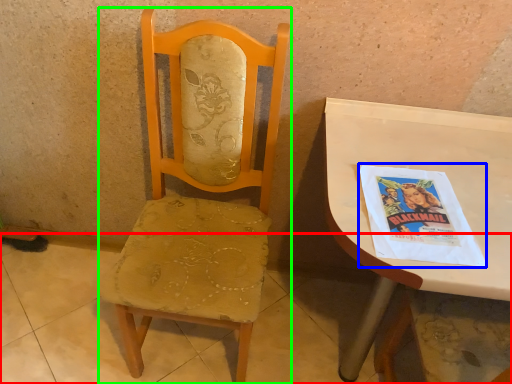
Question: Considering the real-world distances, which object is farthest from concrete (highlighted by a red box)? comic book (highlighted by a blue box) or chair (highlighted by a green box)?

Choices:
 (A) comic book
 (B) chair

Answer: (A)